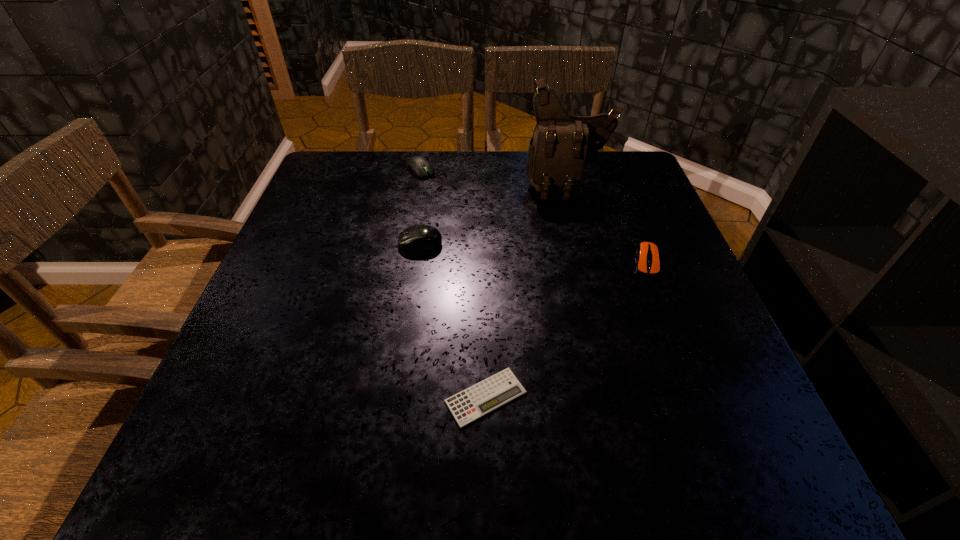
At what (x,y) coordinates should I click in order to perform the action: click on blank space at the right edge of the desktop. Please return your answer as a coordinate pair (x, y). The width and height of the screenshot is (960, 540). Looking at the image, I should click on (609, 205).

Where is `vacant space at the far left corner of the desktop`? vacant space at the far left corner of the desktop is located at coordinates (368, 164).

Identify the location of vacant space that is in between the shoulder bag and the farthest computer mouse. (494, 178).

Where is `free space between the farthest computer mouse and the rightmost computer mouse`? free space between the farthest computer mouse and the rightmost computer mouse is located at coordinates (534, 215).

Identify the location of free spot between the third object from right to left and the second shortest object. (566, 329).

Where is `free spot between the third object from right to left and the second tallest object`? free spot between the third object from right to left and the second tallest object is located at coordinates (453, 320).

Identify the location of free space between the third object from left to right and the fourth tallest object. (566, 329).

Locate an element on the screen. The width and height of the screenshot is (960, 540). vacant area between the second shortest computer mouse and the shoulder bag is located at coordinates (494, 178).

Where is `unoccupied position between the shoulder bag and the second shortest computer mouse`? The width and height of the screenshot is (960, 540). unoccupied position between the shoulder bag and the second shortest computer mouse is located at coordinates (494, 178).

You are a GUI agent. You are given a task and a screenshot of the screen. Output one action in this format:
    pyautogui.click(x=<x>, y=<y>)
    Task: Click on the vacant area that lies between the fourth shortest object and the third tallest object
    This screenshot has width=960, height=540.
    Given the screenshot: What is the action you would take?
    pyautogui.click(x=420, y=207)